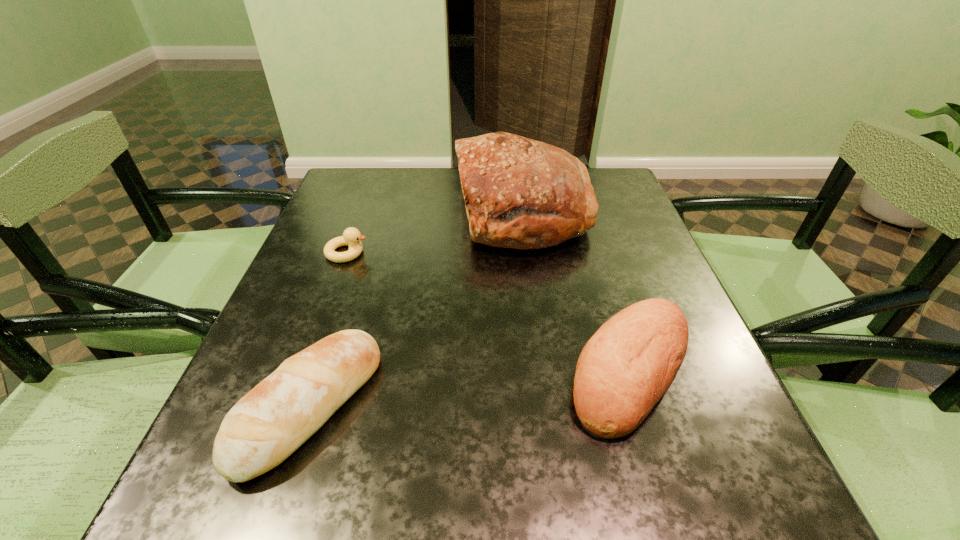
Identify the location of vacant region that satisfies the following two spatial constraints: 1. at the beak of the leftmost bread; 2. on the left side of the shortest object. The height and width of the screenshot is (540, 960). (291, 406).

Where is `free space that satisfies the following two spatial constraints: 1. on the back side of the leftmost bread; 2. at the beak of the shortest object`? This screenshot has width=960, height=540. free space that satisfies the following two spatial constraints: 1. on the back side of the leftmost bread; 2. at the beak of the shortest object is located at coordinates (360, 253).

Find the location of `vacant point that satisfies the following two spatial constraints: 1. at the sliced front of the farthest bread; 2. on the front side of the leftmost bread`. vacant point that satisfies the following two spatial constraints: 1. at the sliced front of the farthest bread; 2. on the front side of the leftmost bread is located at coordinates (550, 406).